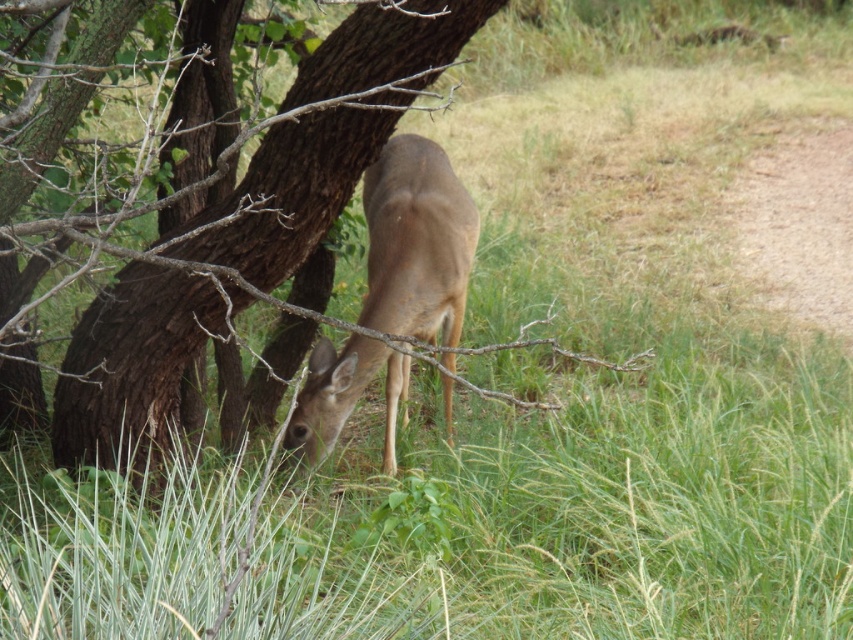
Does brown rough bark tree at center appear on the left side of brown matte/deer at center?

Indeed, brown rough bark tree at center is positioned on the left side of brown matte/deer at center.

Is point (86, 438) closer to camera compared to point (364, 321)?

Yes, it is in front of point (364, 321).

Identify the location of brown rough bark tree at center. (131, 362).